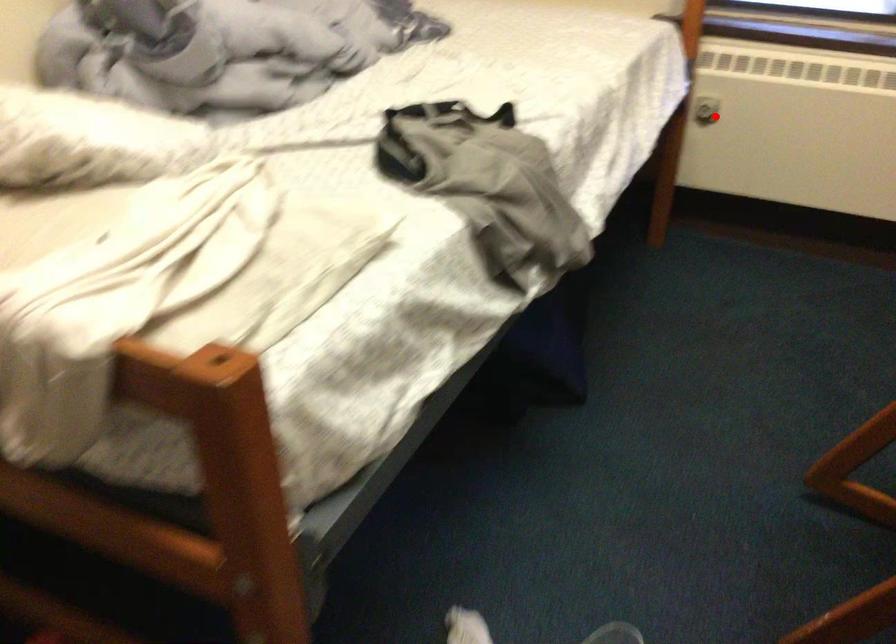
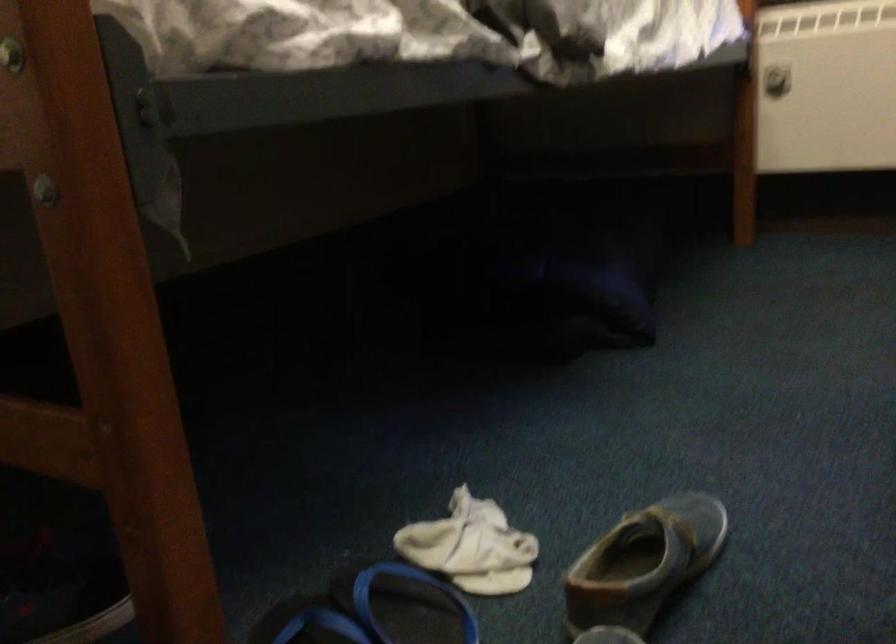
Locate, in the second image, the point that corresponds to the highlighted location in the first image.

(776, 80)